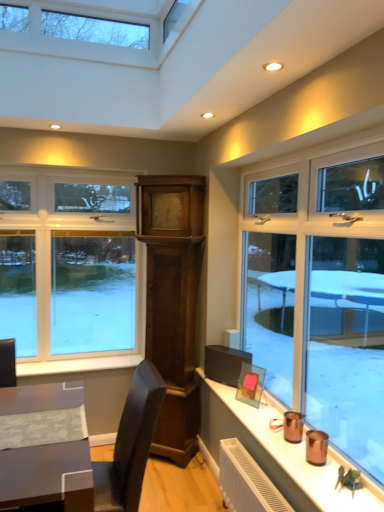
What do you see at coordinates (70, 269) in the screenshot? I see `clear glass window at left` at bounding box center [70, 269].

Image resolution: width=384 pixels, height=512 pixels. What are the coordinates of `clear glass window at left` in the screenshot? It's located at (70, 269).

Measure the distance between clear glass window at left and camera.

They are 2.84 meters apart.

You are a GUI agent. You are given a task and a screenshot of the screen. Output one action in this format:
    pyautogui.click(x=<x>, y=<y>)
    Task: Click on the white wood window sill at lower left
    The width and height of the screenshot is (384, 512).
    Given the screenshot: What is the action you would take?
    pyautogui.click(x=77, y=365)

Describe the element at coordinates (77, 365) in the screenshot. I see `white wood window sill at lower left` at that location.

Where is `clear glass window at left`? clear glass window at left is located at coordinates (70, 269).

Is clear glass window at left to the left or to the right of white wood window sill at lower left in the image?

clear glass window at left is positioned on white wood window sill at lower left's left side.

Between clear glass window at left and white wood window sill at lower left, which one is positioned behind?

clear glass window at left is further from the camera.

Is point (111, 278) closer or farther from the camera than point (36, 362)?

Point (111, 278).

From the image's perspective, between clear glass window at left and white wood window sill at lower left, who is located below?

white wood window sill at lower left is shown below in the image.

From a real-world perspective, is clear glass window at left on white wood window sill at lower left?

Correct, in the physical world, clear glass window at left is higher than white wood window sill at lower left.

Which object is wider, clear glass window at left or white wood window sill at lower left?

With larger width is white wood window sill at lower left.

Considering the relative sizes of clear glass window at left and white wood window sill at lower left in the image provided, is clear glass window at left shorter than white wood window sill at lower left?

No, clear glass window at left is not shorter than white wood window sill at lower left.

Is clear glass window at left bigger or smaller than white wood window sill at lower left?

clear glass window at left is bigger than white wood window sill at lower left.

Can we say clear glass window at left lies outside white wood window sill at lower left?

clear glass window at left lies outside white wood window sill at lower left's area.

Is clear glass window at left far from white wood window sill at lower left?

No, clear glass window at left is not far away from white wood window sill at lower left.

Is clear glass window at left positioned with its back to white wood window sill at lower left?

No, clear glass window at left's orientation is not away from white wood window sill at lower left.

Consider the image. How different are the orientations of clear glass window at left and white wood window sill at lower left in degrees?

The angle between the facing direction of clear glass window at left and the facing direction of white wood window sill at lower left is 0.000329 degrees.

Measure the distance between clear glass window at left and white wood window sill at lower left.

clear glass window at left is 22.55 inches from white wood window sill at lower left.

I want to click on window behind the white wood window sill at lower left, so click(70, 269).

Looking at this image, between white wood window sill at lower left and clear glass window at left, which one appears on the right side from the viewer's perspective?

white wood window sill at lower left is more to the right.

Considering the positions of objects white wood window sill at lower left and clear glass window at left in the image provided, who is behind, white wood window sill at lower left or clear glass window at left?

clear glass window at left is behind.

Is point (69, 365) less distant than point (52, 328)?

Yes.

From the image's perspective, is white wood window sill at lower left positioned above or below clear glass window at left?

white wood window sill at lower left is situated lower than clear glass window at left in the image.

From a real-world perspective, is white wood window sill at lower left below clear glass window at left?

Yes.

Considering the sizes of objects white wood window sill at lower left and clear glass window at left in the image provided, who is wider, white wood window sill at lower left or clear glass window at left?

white wood window sill at lower left is wider.

Considering the relative sizes of white wood window sill at lower left and clear glass window at left in the image provided, is white wood window sill at lower left shorter than clear glass window at left?

Yes, white wood window sill at lower left is shorter than clear glass window at left.

Can you confirm if white wood window sill at lower left is smaller than clear glass window at left?

Correct, white wood window sill at lower left occupies less space than clear glass window at left.

Is white wood window sill at lower left surrounding clear glass window at left?

No, clear glass window at left is not a part of white wood window sill at lower left.

Is white wood window sill at lower left not near clear glass window at left?

That's not correct — white wood window sill at lower left is a little close to clear glass window at left.

Could you tell me if white wood window sill at lower left is facing clear glass window at left?

No.

What's the angular difference between white wood window sill at lower left and clear glass window at left's facing directions?

The angular difference between white wood window sill at lower left and clear glass window at left is 0.000329 degrees.

How distant is white wood window sill at lower left from clear glass window at left?

white wood window sill at lower left and clear glass window at left are 22.55 inches apart.

The height and width of the screenshot is (512, 384). In order to click on window sill in front of the clear glass window at left in this screenshot , I will do `click(77, 365)`.

I want to click on window above the white wood window sill at lower left (from the image's perspective), so click(x=70, y=269).

Locate an element on the screen. window behind the white wood window sill at lower left is located at coordinates (70, 269).